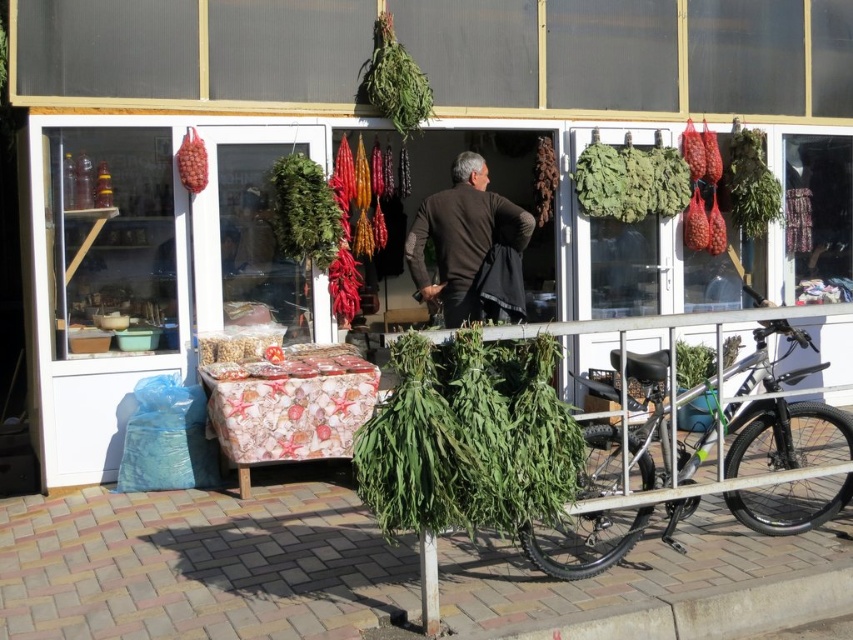
Question: Can you confirm if silver metallic bicycle at lower right is smaller than brown woolen jacket at center?

Choices:
 (A) no
 (B) yes

Answer: (A)

Question: Among these objects, which one is farthest from the camera?

Choices:
 (A) matte red grapes at upper left
 (B) silver metallic bicycle at lower right
 (C) green leafy vegetables at upper right
 (D) brown woolen jacket at center

Answer: (C)

Question: Which object is closer to the camera taking this photo?

Choices:
 (A) silver metallic bicycle at lower right
 (B) matte red grapes at upper left

Answer: (A)

Question: Is brown woolen jacket at center bigger than matte red grapes at upper left?

Choices:
 (A) yes
 (B) no

Answer: (A)

Question: Is brown woolen jacket at center behind matte red grapes at upper left?

Choices:
 (A) yes
 (B) no

Answer: (B)

Question: Among these points, which one is farthest from the camera?

Choices:
 (A) (637, 180)
 (B) (206, 157)

Answer: (A)